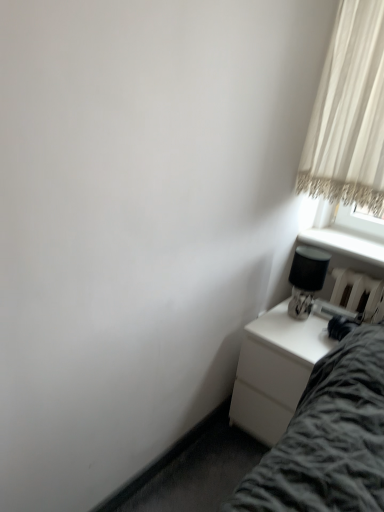
Image resolution: width=384 pixels, height=512 pixels. Find the location of `blank area to the left of black glossy table lamp at right`. blank area to the left of black glossy table lamp at right is located at coordinates (271, 318).